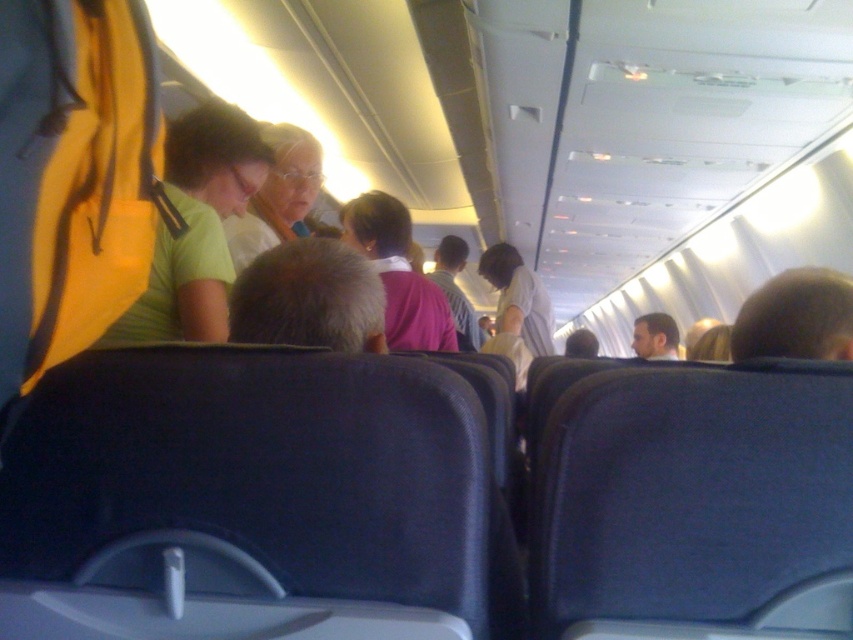
How far apart are green matte shirt at upper left and white fabric flight attendant at center?

They are 1.98 meters apart.

Is green matte shirt at upper left shorter than white fabric flight attendant at center?

Correct, green matte shirt at upper left is not as tall as white fabric flight attendant at center.

Between point (196, 230) and point (494, 262), which one is positioned behind?

The point (494, 262) is more distant.

At what (x,y) coordinates should I click in order to perform the action: click on green matte shirt at upper left. Please return your answer as a coordinate pair (x, y). Looking at the image, I should click on (196, 227).